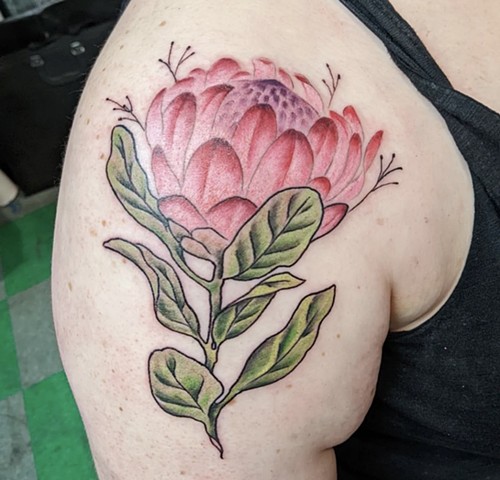
At what (x,y) coordinates should I click in order to perform the action: click on floor. Please return your answer as a coordinate pair (x, y). This screenshot has height=480, width=500. Looking at the image, I should click on (44, 441).